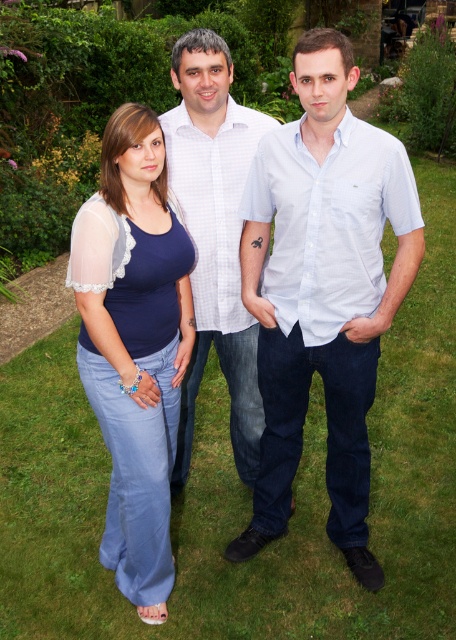
In the scene shown: You are trying to decide which item of clothing to take with you on a trip where space is limited. You have the light blue cotton shirt at center and the blue denim jeans at center. Based on their widths, which one should you choose to pack first?

The light blue cotton shirt at center might be wider than the blue denim jeans at center, so you should pack the blue denim jeans at center first since it is likely narrower and takes up less space.